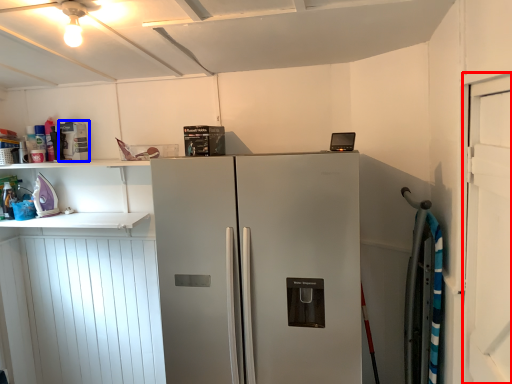
Question: Which of the following is the closest to the observer, door (highlighted by a red box) or appliance (highlighted by a blue box)?

Choices:
 (A) door
 (B) appliance

Answer: (A)